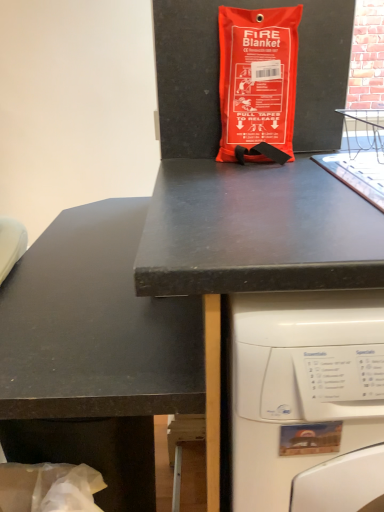
What is the approximate width of black matte counter top at center?

The width of black matte counter top at center is 18.09 inches.

Measure the distance between black matte desk at upper center and camera.

black matte desk at upper center is 47.24 centimeters from camera.

Describe the element at coordinates (170, 288) in the screenshot. I see `black matte desk at upper center` at that location.

Image resolution: width=384 pixels, height=512 pixels. I want to click on black matte counter top at center, so [x=95, y=326].

From a real-world perspective, is orange fabric fire blanket at center beneath black matte desk at upper center?

No, from a real-world perspective, orange fabric fire blanket at center is not below black matte desk at upper center.

Is orange fabric fire blanket at center not near black matte desk at upper center?

Actually, orange fabric fire blanket at center and black matte desk at upper center are a little close together.

Is orange fabric fire blanket at center shorter than black matte desk at upper center?

Yes, orange fabric fire blanket at center is shorter than black matte desk at upper center.

Would you consider black matte counter top at center to be distant from orange fabric fire blanket at center?

No, black matte counter top at center is not far away from orange fabric fire blanket at center.

Which object is closer to the camera taking this photo, black matte counter top at center or orange fabric fire blanket at center?

black matte counter top at center is in front.

Which of these two, black matte counter top at center or orange fabric fire blanket at center, is thinner?

orange fabric fire blanket at center is thinner.

Is orange fabric fire blanket at center looking in the opposite direction of black matte counter top at center?

orange fabric fire blanket at center does not have its back to black matte counter top at center.

From the image's perspective, who appears lower, orange fabric fire blanket at center or black matte counter top at center?

black matte counter top at center appears lower in the image.

Is point (235, 113) closer or farther from the camera than point (86, 358)?

Point (235, 113) is positioned farther from the camera compared to point (86, 358).

How distant is orange fabric fire blanket at center from black matte counter top at center?

They are 18.73 inches apart.

Is black matte desk at upper center oriented away from orange fabric fire blanket at center?

No, black matte desk at upper center is not facing the opposite direction of orange fabric fire blanket at center.

Does black matte desk at upper center have a smaller size compared to orange fabric fire blanket at center?

No.

In terms of width, does black matte desk at upper center look wider or thinner when compared to orange fabric fire blanket at center?

black matte desk at upper center is wider than orange fabric fire blanket at center.

Which object is positioned more to the right, black matte desk at upper center or orange fabric fire blanket at center?

From the viewer's perspective, black matte desk at upper center appears more on the right side.

Is black matte desk at upper center touching black matte counter top at center?

Yes, black matte desk at upper center is beside black matte counter top at center.

Can you confirm if black matte desk at upper center is smaller than black matte counter top at center?

No.

Can you confirm if black matte desk at upper center is thinner than black matte counter top at center?

In fact, black matte desk at upper center might be wider than black matte counter top at center.

Is the depth of black matte desk at upper center less than that of black matte counter top at center?

That is True.

Is the surface of black matte counter top at center in direct contact with black matte desk at upper center?

Yes, black matte counter top at center and black matte desk at upper center clearly make contact.

Between black matte counter top at center and black matte desk at upper center, which one has larger size?

Bigger between the two is black matte desk at upper center.

Considering the points (68, 384) and (221, 181), which point is behind, point (68, 384) or point (221, 181)?

The point (221, 181) is farther.

Does black matte counter top at center appear on the left side of black matte desk at upper center?

Correct, you'll find black matte counter top at center to the left of black matte desk at upper center.

I want to click on desk on the right of orange fabric fire blanket at center, so click(x=170, y=288).

The height and width of the screenshot is (512, 384). I want to click on counter top below the orange fabric fire blanket at center (from a real-world perspective), so click(x=95, y=326).

From the image, which object appears to be nearer to orange fabric fire blanket at center, black matte counter top at center or black matte desk at upper center?

The object closer to orange fabric fire blanket at center is black matte desk at upper center.

Based on their spatial positions, is black matte desk at upper center or black matte counter top at center closer to orange fabric fire blanket at center?

The object closer to orange fabric fire blanket at center is black matte desk at upper center.

From the image, which object appears to be nearer to black matte counter top at center, orange fabric fire blanket at center or black matte desk at upper center?

black matte desk at upper center lies closer to black matte counter top at center than the other object.

When comparing their distances from black matte desk at upper center, does orange fabric fire blanket at center or black matte counter top at center seem further?

Based on the image, orange fabric fire blanket at center appears to be further to black matte desk at upper center.

Based on their spatial positions, is black matte counter top at center or orange fabric fire blanket at center further from black matte desk at upper center?

orange fabric fire blanket at center lies further to black matte desk at upper center than the other object.

From the image, which object appears to be nearer to black matte counter top at center, black matte desk at upper center or orange fabric fire blanket at center?

Based on the image, black matte desk at upper center appears to be nearer to black matte counter top at center.

What are the coordinates of `desk between orange fabric fire blanket at center and black matte counter top at center from top to bottom` in the screenshot? It's located at (170, 288).